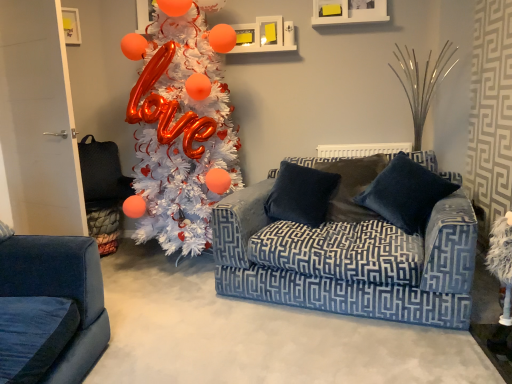
Question: Considering the positions of velvet dark blue pillow at center, placed as the 2th pillow when sorted from left to right, and velvet dark blue pillow at center, the 1th pillow in the left-to-right sequence, in the image, is velvet dark blue pillow at center, placed as the 2th pillow when sorted from left to right, taller or shorter than velvet dark blue pillow at center, the 1th pillow in the left-to-right sequence,?

Choices:
 (A) tall
 (B) short

Answer: (A)

Question: Considering their positions, is velvet dark blue pillow at center, which is the first pillow from right to left, located in front of or behind velvet dark blue pillow at center, acting as the 2th pillow starting from the right?

Choices:
 (A) behind
 (B) front

Answer: (B)

Question: Which of these objects is positioned closest to the white matte christmas tree at left?

Choices:
 (A) velvet dark blue pillow at center, the 1th pillow in the left-to-right sequence
 (B) velvet blue couch at center
 (C) velvet dark blue pillow at center, which is the first pillow from right to left

Answer: (A)

Question: Which object is positioned closest to the white matte christmas tree at left?

Choices:
 (A) velvet dark blue pillow at center, placed as the 2th pillow when sorted from left to right
 (B) velvet dark blue pillow at center, the 1th pillow in the left-to-right sequence
 (C) velvet blue couch at center

Answer: (B)